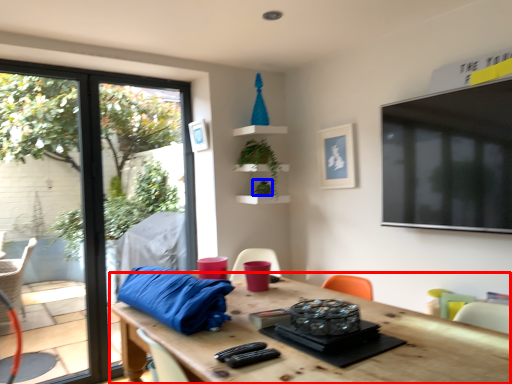
Question: Which of the following is the farthest to the observer, table (highlighted by a red box) or plant (highlighted by a blue box)?

Choices:
 (A) table
 (B) plant

Answer: (B)